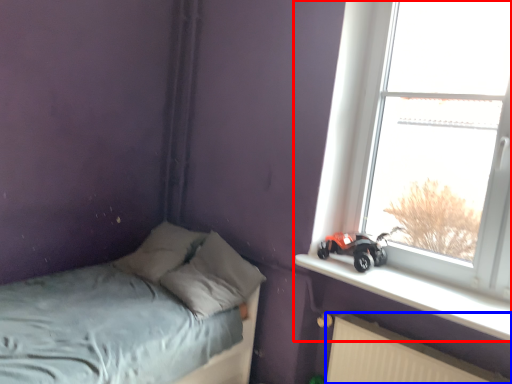
Question: Which object appears farthest to the camera in this image, window (highlighted by a red box) or radiator (highlighted by a blue box)?

Choices:
 (A) window
 (B) radiator

Answer: (A)